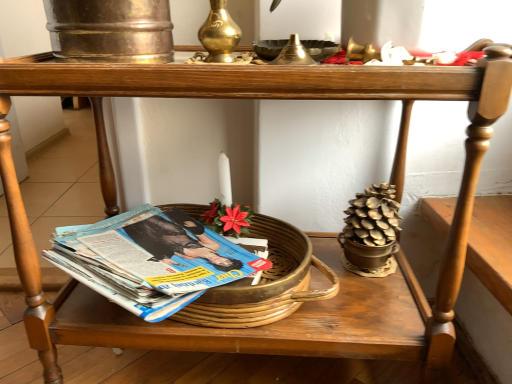
The height and width of the screenshot is (384, 512). I want to click on vacant region in front of metallic gold bowl at upper center, so click(301, 66).